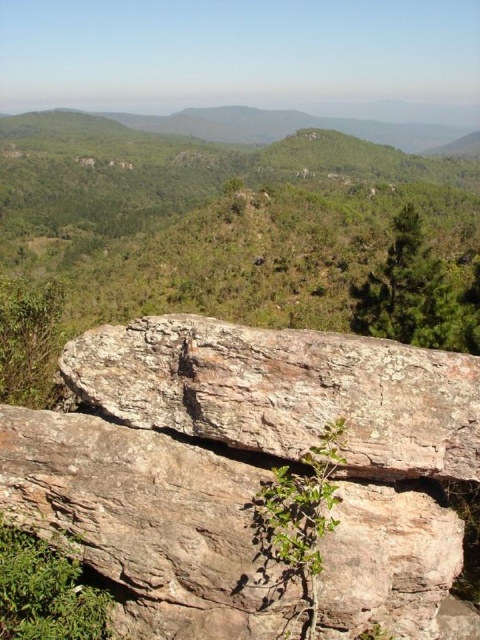
Describe the element at coordinates (287, 392) in the screenshot. I see `rusty brown rock at center` at that location.

Is rusty brown rock at center shorter than green textured tree at upper right?

Yes, rusty brown rock at center is shorter than green textured tree at upper right.

Does point (274, 396) lie in front of point (424, 330)?

Yes, it is in front of point (424, 330).

You are a GUI agent. You are given a task and a screenshot of the screen. Output one action in this format:
    pyautogui.click(x=<x>, y=<y>)
    Task: Click on the rusty brown rock at center
    The height and width of the screenshot is (640, 480).
    Given the screenshot: What is the action you would take?
    pyautogui.click(x=287, y=392)

Is rusty rock at center to the left of rusty brown rock at center from the viewer's perspective?

Yes, rusty rock at center is to the left of rusty brown rock at center.

How much distance is there between rusty rock at center and rusty brown rock at center?

rusty rock at center and rusty brown rock at center are 82.66 centimeters apart.

What are the coordinates of `rusty rock at center` in the screenshot? It's located at (148, 524).

Find the location of a particular element. rusty rock at center is located at coordinates (148, 524).

Does rusty rock at center appear over green textured tree at upper right?

No.

Between rusty rock at center and green textured tree at upper right, which one is positioned lower?

Positioned lower is rusty rock at center.

Is point (252, 532) closer to camera compared to point (368, 314)?

Yes.

You are a GUI agent. You are given a task and a screenshot of the screen. Output one action in this format:
    pyautogui.click(x=<x>, y=<y>)
    Task: Click on the rusty rock at center
    The width and height of the screenshot is (480, 640).
    Given the screenshot: What is the action you would take?
    pyautogui.click(x=148, y=524)